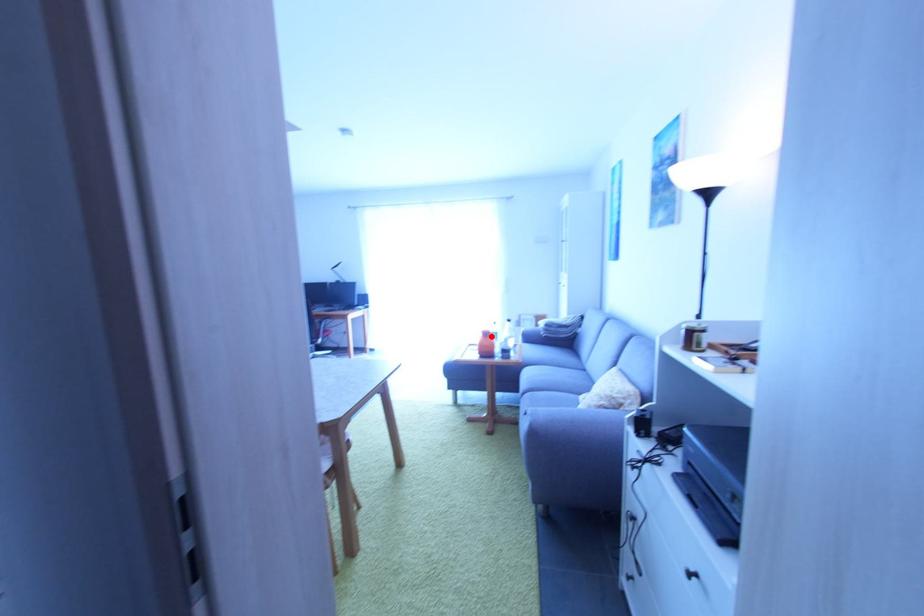
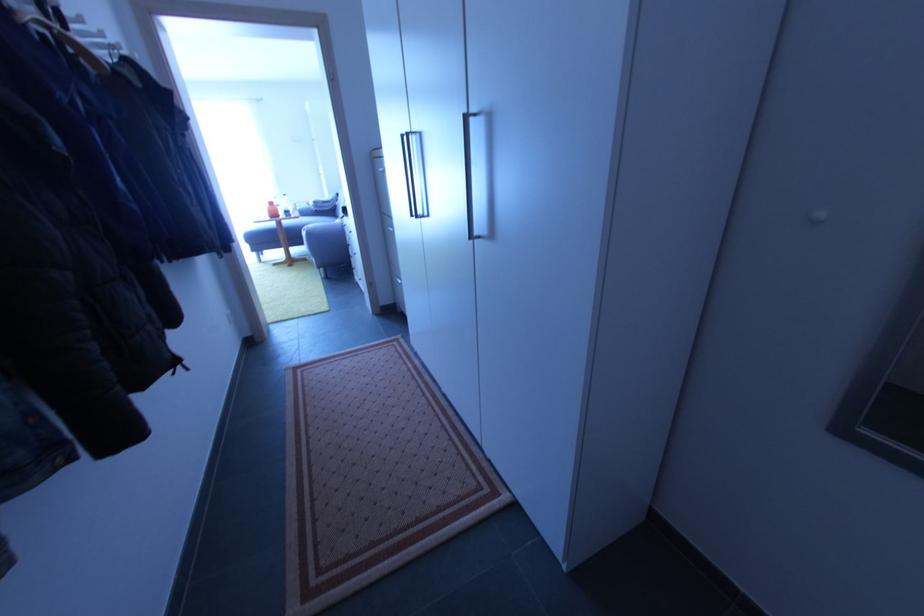
Question: I am providing you with two images of the same scene from different viewpoints. A red point is shown in image1. For the corresponding object point in image2, is it positioned nearer or farther from the camera?

Choices:
 (A) Nearer
 (B) Farther

Answer: (A)